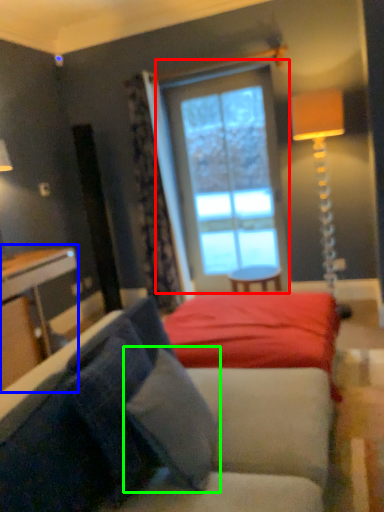
Question: Which is farther away from window (highlighted by a red box)? table (highlighted by a blue box) or pillow (highlighted by a green box)?

Choices:
 (A) table
 (B) pillow

Answer: (B)